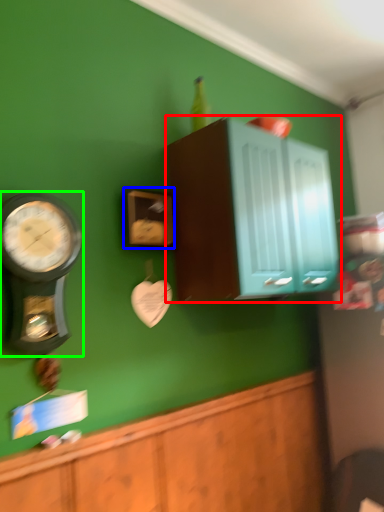
Question: Which is nearer to the cabinetry (highlighted by a red box)? clock (highlighted by a blue box) or wall clock (highlighted by a green box).

Choices:
 (A) clock
 (B) wall clock

Answer: (A)